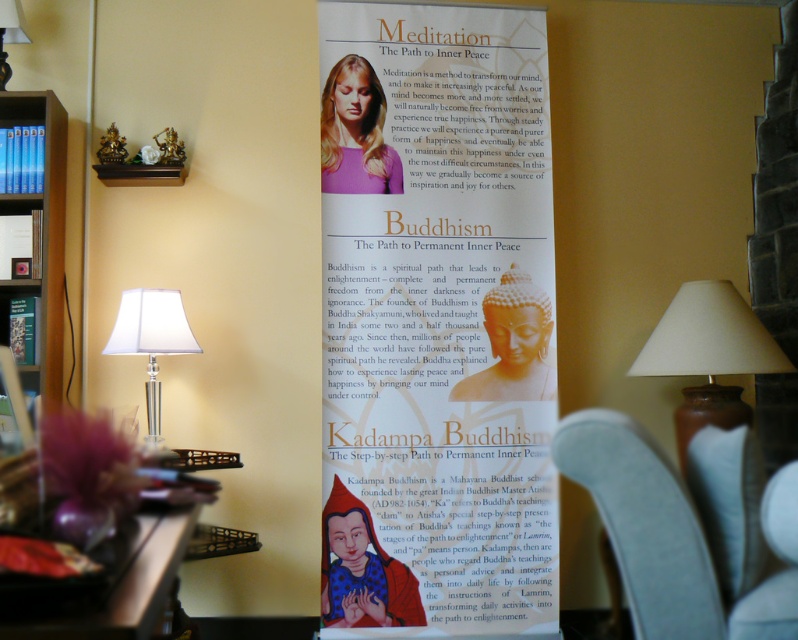
Question: Among these objects, which one is nearest to the camera?

Choices:
 (A) gray fabric armchair at lower center
 (B) blue hardcover books at left
 (C) purple matte shirt at upper center

Answer: (A)

Question: Does gray fabric armchair at lower center appear on the left side of purple matte shirt at upper center?

Choices:
 (A) no
 (B) yes

Answer: (A)

Question: Does gray fabric armchair at lower center have a larger size compared to white fabric lampshade at left?

Choices:
 (A) yes
 (B) no

Answer: (B)

Question: Does matte paper poster at center have a lesser width compared to blue hardcover books at left?

Choices:
 (A) yes
 (B) no

Answer: (B)

Question: Considering the real-world distances, which object is closest to the matte paper poster at center?

Choices:
 (A) gray fabric armchair at lower center
 (B) purple matte shirt at upper center

Answer: (B)

Question: Among these points, which one is nearest to the camera?

Choices:
 (A) (141, 316)
 (B) (559, 452)
 (C) (350, 86)

Answer: (B)